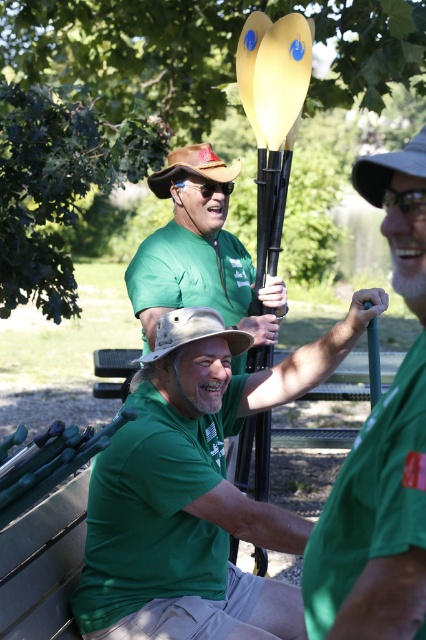
You are a coach observing two kayak paddles in the scene. The green matte kayak paddle at center and the green matte kayak paddle at right. Which one is taller?

The green matte kayak paddle at center is taller than the green matte kayak paddle at right.

You are a photographer trying to capture a shot of both the green matte kayak paddle at center and the green matte kayak paddle at right. If you want to frame them so that the one on the left is fully visible without being cut off, which paddle should you position closer to the edge of your camera frame?

You should position the green matte kayak paddle at center closer to the edge of your camera frame since it is to the left of the green matte kayak paddle at right, ensuring it stays fully visible.